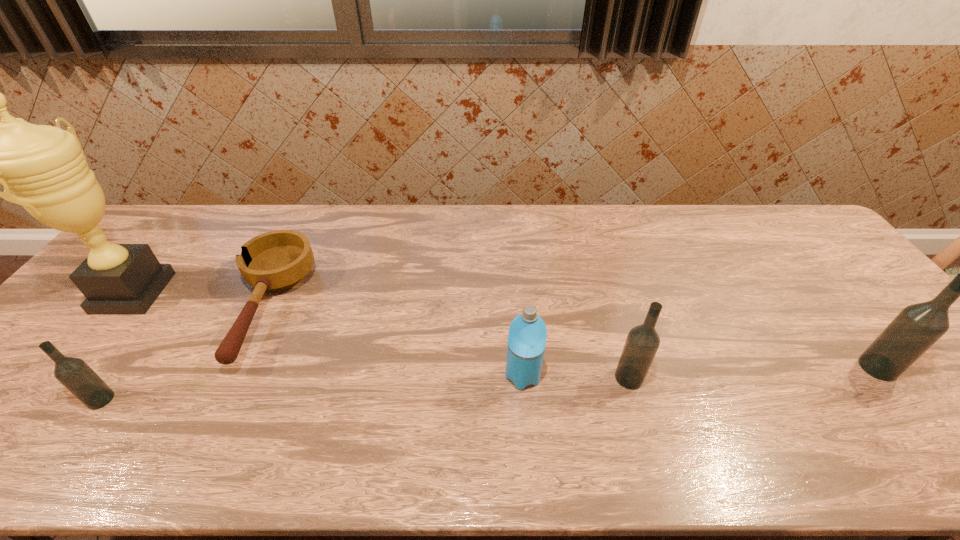
You are a GUI agent. You are given a task and a screenshot of the screen. Output one action in this format:
    pyautogui.click(x=<x>, y=<y>)
    Task: Click on the vacant space at the near edge
    This screenshot has width=960, height=540.
    Given the screenshot: What is the action you would take?
    pyautogui.click(x=123, y=409)

The width and height of the screenshot is (960, 540). I want to click on free point at the far right corner, so coord(774,224).

Identify the location of empty space between the second vodka from right to left and the tallest object. (381, 335).

What are the coordinates of `vacant space that's between the third object from left to right and the rightmost vodka` in the screenshot? It's located at (572, 338).

You are a GUI agent. You are given a task and a screenshot of the screen. Output one action in this format:
    pyautogui.click(x=<x>, y=<y>)
    Task: Click on the vacant area that lies between the tallest object and the thermos bottle
    The image size is (960, 540).
    Given the screenshot: What is the action you would take?
    [328, 334]

Find the location of a particular element. This screenshot has height=540, width=960. free space between the trophy cup and the second tallest vodka is located at coordinates (381, 335).

I want to click on vacant space that is in between the fourth object from left to right and the fourth object from right to left, so click(396, 342).

Find the location of a particular element. The height and width of the screenshot is (540, 960). vacant space that is in between the leftmost object and the fifth object from left to right is located at coordinates (381, 335).

Where is `empty space that is in between the leftmost vodka and the tallest object`? This screenshot has width=960, height=540. empty space that is in between the leftmost vodka and the tallest object is located at coordinates (117, 346).

The height and width of the screenshot is (540, 960). Find the location of `free area in between the rightmost vodka and the tallest object`. free area in between the rightmost vodka and the tallest object is located at coordinates click(x=506, y=330).